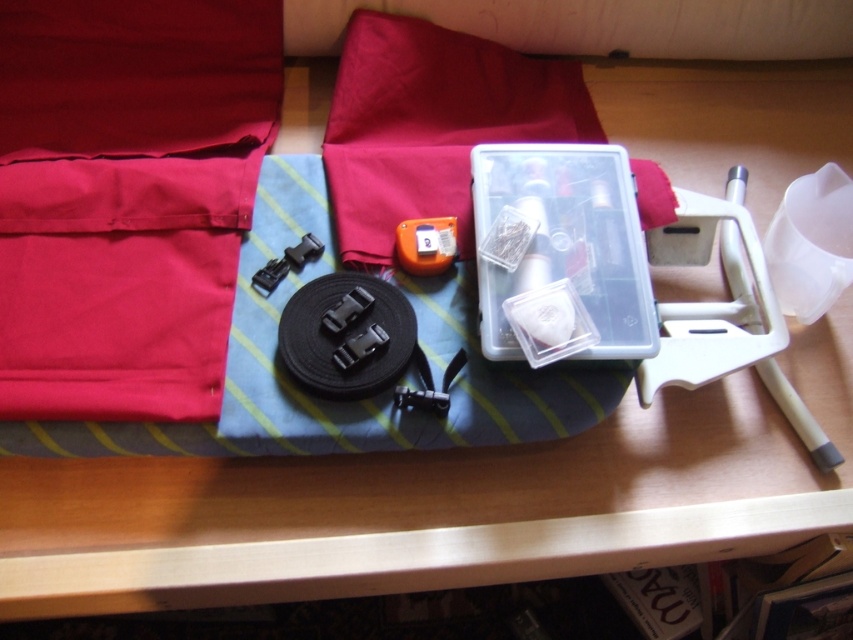
Which is behind, point (762, 294) or point (418, 227)?

The point (762, 294) is behind.

Between white plastic stand at right and orange matte tape measure at center, which one is positioned higher?

orange matte tape measure at center

The height and width of the screenshot is (640, 853). Describe the element at coordinates (724, 310) in the screenshot. I see `white plastic stand at right` at that location.

Locate an element on the screen. The image size is (853, 640). white plastic stand at right is located at coordinates (724, 310).

Is clear plastic container at center positioned behind white plastic stand at right?

No.

Can you confirm if clear plastic container at center is taller than white plastic stand at right?

In fact, clear plastic container at center may be shorter than white plastic stand at right.

You are a GUI agent. You are given a task and a screenshot of the screen. Output one action in this format:
    pyautogui.click(x=<x>, y=<y>)
    Task: Click on the clear plastic container at center
    
    Given the screenshot: What is the action you would take?
    pyautogui.click(x=566, y=243)

Based on the photo, between clear plastic container at center and orange matte tape measure at center, which one is positioned higher?

Positioned higher is orange matte tape measure at center.

Does clear plastic container at center appear on the right side of orange matte tape measure at center?

Yes, clear plastic container at center is to the right of orange matte tape measure at center.

At what (x,y) coordinates should I click in order to perform the action: click on clear plastic container at center. Please return your answer as a coordinate pair (x, y). Image resolution: width=853 pixels, height=640 pixels. Looking at the image, I should click on coord(566,243).

Find the location of a particular element. This screenshot has width=853, height=640. clear plastic container at center is located at coordinates (566, 243).